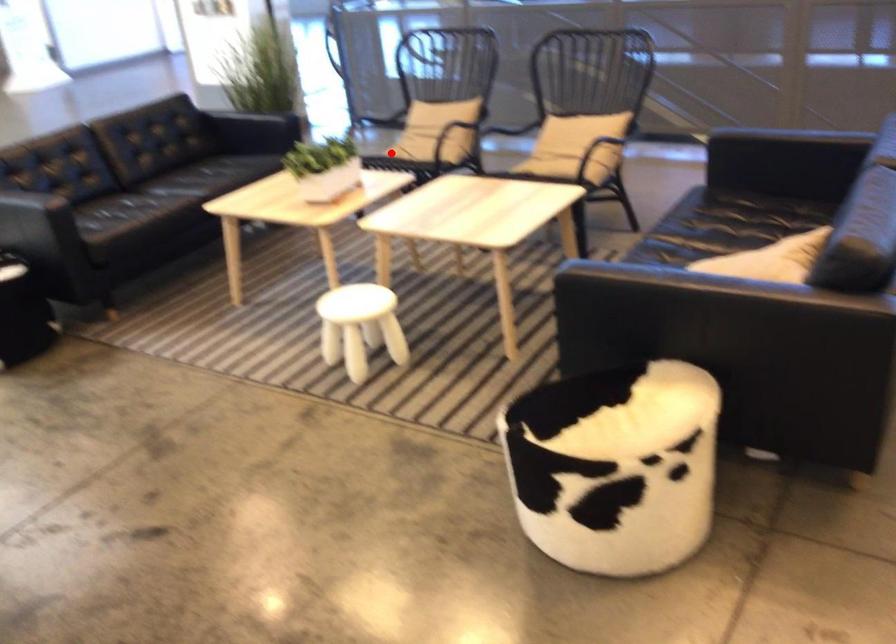
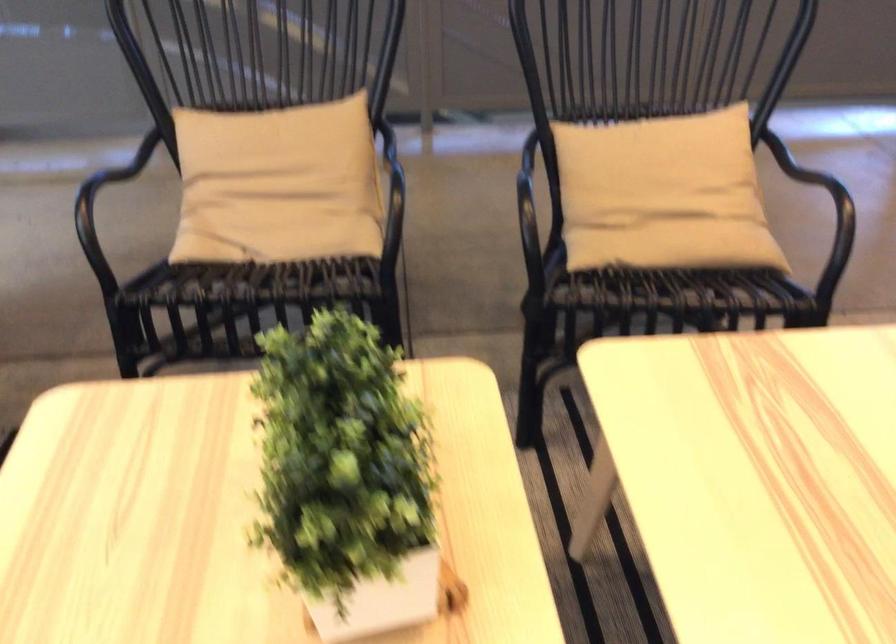
Find the pixel in the second image that matches the highlighted location in the first image.

(268, 267)